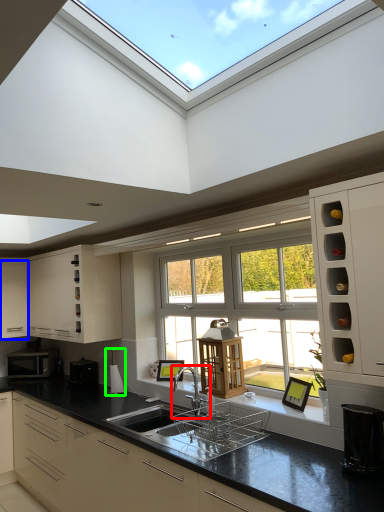
Question: Which object is positioned closest to tap (highlighted by a red box)? Select from cabinetry (highlighted by a blue box) and appliance (highlighted by a green box).

Choices:
 (A) cabinetry
 (B) appliance

Answer: (B)